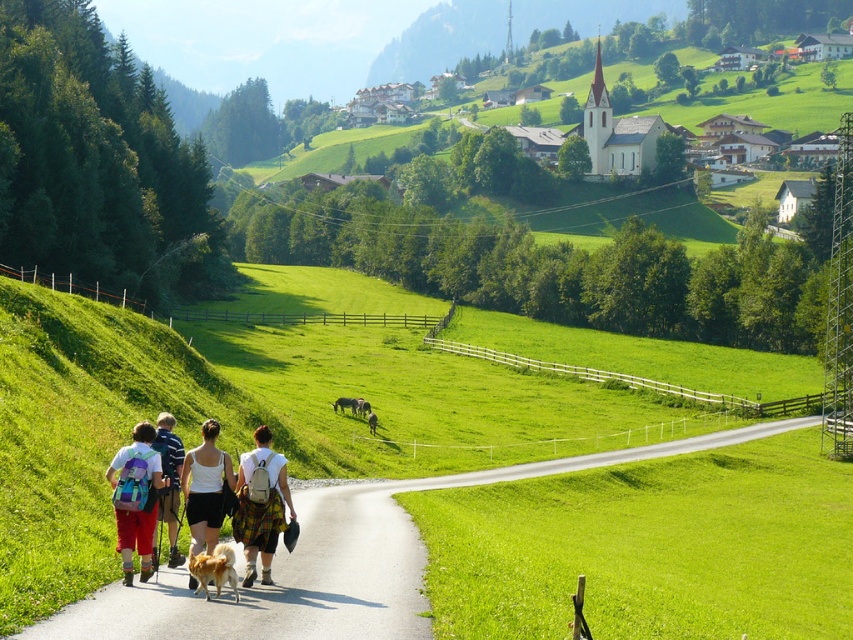
You are a photographer standing at the bottom of the path in this rural landscape. You want to take a photo of the white fabric skirt at center and the golden fur dog at lower center so that both are clearly visible. Which object should you focus on first to ensure sharpness, considering their sizes in the frame?

The white fabric skirt at center is taller than the golden fur dog at lower center, so you should focus on the white fabric skirt at center first to ensure both are in focus since it is larger and closer to the camera.

You are a photographer standing at the start of the paved path in the rural landscape scene. You want to take a photo that includes both the white fabric skirt at center and the matte blue backpack at center. Which object should you adjust your camera angle to focus on first if you want to ensure both are in frame?

The white fabric skirt at center is positioned on the right side of matte blue backpack at center, so you should focus on the matte blue backpack at center first to ensure both objects are within the frame.

You are a photographer trying to capture the golden fur dog at lower center and the white fabric skirt at center in the same frame. Based on their sizes, which object should you focus on first to ensure both are in focus?

The golden fur dog at lower center is thicker than the white fabric skirt at center, so you should focus on the golden fur dog at lower center first to ensure both are in focus.